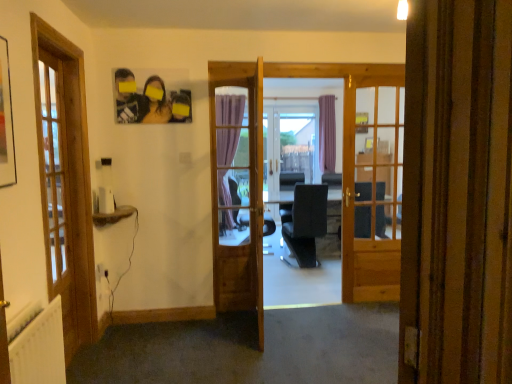
Question: Considering the relative positions of white plastic screen door at center and wooden door at center in the image provided, is white plastic screen door at center to the left or to the right of wooden door at center?

Choices:
 (A) right
 (B) left

Answer: (A)

Question: From the image's perspective, relative to wooden door at center, is white plastic screen door at center above or below?

Choices:
 (A) below
 (B) above

Answer: (B)

Question: Estimate the real-world distances between objects in this image. Which object is closer to the wooden door at center?

Choices:
 (A) white textured radiator at lower left
 (B) white plastic screen door at center

Answer: (A)

Question: Estimate the real-world distances between objects in this image. Which object is closer to the white plastic screen door at center?

Choices:
 (A) white textured radiator at lower left
 (B) wooden door at center

Answer: (B)